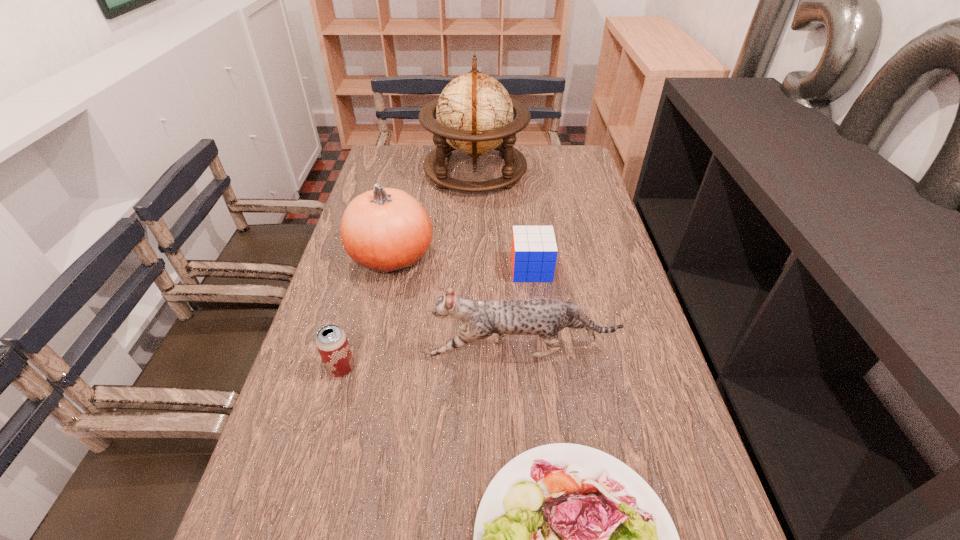
Identify the location of free spot located 0.270m on the face of the fourth shortest object. Image resolution: width=960 pixels, height=540 pixels. (313, 350).

At what (x,y) coordinates should I click in order to perform the action: click on blank space located 0.060m on the left of the beer can. Please return your answer as a coordinate pair (x, y). Looking at the image, I should click on (300, 368).

Where is `vacant space situated 0.230m on the left of the cube`? The image size is (960, 540). vacant space situated 0.230m on the left of the cube is located at coordinates (429, 269).

At what (x,y) coordinates should I click in order to perform the action: click on object that is at the far edge. Please return your answer as a coordinate pair (x, y). The height and width of the screenshot is (540, 960). Looking at the image, I should click on (474, 112).

Locate an element on the screen. pumpkin that is at the left edge is located at coordinates (387, 230).

Where is `beer can that is at the left edge`? beer can that is at the left edge is located at coordinates (331, 340).

Where is `object that is positioned at the right edge`? This screenshot has height=540, width=960. object that is positioned at the right edge is located at coordinates (545, 317).

Find the location of a particular element. This screenshot has width=960, height=540. free space at the far edge of the desktop is located at coordinates (494, 161).

Image resolution: width=960 pixels, height=540 pixels. In the image, there is a desktop. In order to click on free region at the left edge in this screenshot , I will do `click(304, 375)`.

In the image, there is a desktop. Where is `vacant space at the right edge`? vacant space at the right edge is located at coordinates (665, 462).